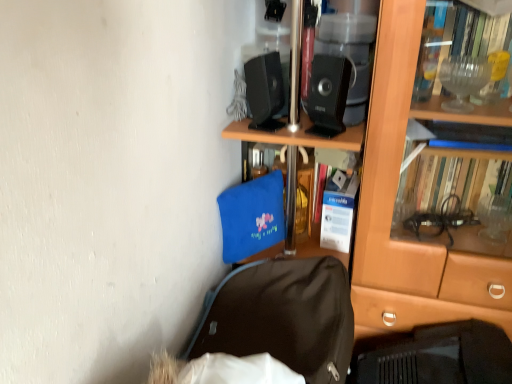
What do you see at coordinates (282, 316) in the screenshot? The image size is (512, 384). I see `black fabric backpack at lower center` at bounding box center [282, 316].

Where is `black fabric backpack at lower center`? This screenshot has height=384, width=512. black fabric backpack at lower center is located at coordinates (282, 316).

Where is `blue fabric bag at center`? This screenshot has height=384, width=512. blue fabric bag at center is located at coordinates (252, 216).

Measure the distance between point [254,201] and camera.

Point [254,201] and camera are 1.09 meters apart from each other.

What do you see at coordinates (441, 356) in the screenshot? This screenshot has height=384, width=512. I see `black matte laptop at lower right` at bounding box center [441, 356].

At what (x,y) coordinates should I click in order to perform the action: click on black plastic speaker at upper center, marked as the 2th loudspeaker in a left-to-right arrangement. Please return your answer as a coordinate pair (x, y). The width and height of the screenshot is (512, 384). Looking at the image, I should click on (328, 94).

Can you confirm if black matte laptop at lower right is smaller than black plastic speaker at upper center, which ranks as the 1th loudspeaker in left-to-right order?

Actually, black matte laptop at lower right might be larger than black plastic speaker at upper center, which ranks as the 1th loudspeaker in left-to-right order.

Based on the photo, from a real-world perspective, which is physically above, black matte laptop at lower right or black plastic speaker at upper center, which ranks as the 1th loudspeaker in left-to-right order?

black plastic speaker at upper center, which ranks as the 1th loudspeaker in left-to-right order, from a real-world perspective.

Is black matte laptop at lower right outside of black plastic speaker at upper center, which ranks as the 1th loudspeaker in left-to-right order?

black matte laptop at lower right is positioned outside black plastic speaker at upper center, which ranks as the 1th loudspeaker in left-to-right order.

Does black matte laptop at lower right lie behind black plastic speaker at upper center, which ranks as the 1th loudspeaker in left-to-right order?

No, it is in front of black plastic speaker at upper center, which ranks as the 1th loudspeaker in left-to-right order.

Is black matte laptop at lower right directly adjacent to brown wooden bookcase at center?

No.

Can you confirm if black matte laptop at lower right is bigger than brown wooden bookcase at center?

No, black matte laptop at lower right is not bigger than brown wooden bookcase at center.

I want to click on laptop below the brown wooden bookcase at center (from the image's perspective), so click(441, 356).

Is black matte laptop at lower right facing towards brown wooden bookcase at center?

No, black matte laptop at lower right is not oriented towards brown wooden bookcase at center.

Which is nearer, (270, 93) or (280, 198)?

Point (270, 93) is closer to the camera than point (280, 198).

From the image's perspective, relative to blue fabric bag at center, is black plastic speaker at upper center, positioned as the 2th loudspeaker in right-to-left order, above or below?

black plastic speaker at upper center, positioned as the 2th loudspeaker in right-to-left order, is above blue fabric bag at center.

From a real-world perspective, is black plastic speaker at upper center, positioned as the 2th loudspeaker in right-to-left order, physically located above or below blue fabric bag at center?

From a real-world perspective, black plastic speaker at upper center, positioned as the 2th loudspeaker in right-to-left order, is physically above blue fabric bag at center.

Find the location of a particular element. luggage and bags that is behind the black plastic speaker at upper center, positioned as the 2th loudspeaker in right-to-left order is located at coordinates (252, 216).

The width and height of the screenshot is (512, 384). In order to click on luggage and bags below the black plastic speaker at upper center, which is counted as the 1th loudspeaker, starting from the right (from the image's perspective) in this screenshot , I will do `click(252, 216)`.

From the image's perspective, which one is positioned higher, blue fabric bag at center or black plastic speaker at upper center, which is counted as the 1th loudspeaker, starting from the right?

black plastic speaker at upper center, which is counted as the 1th loudspeaker, starting from the right, from the image's perspective.

Who is bigger, blue fabric bag at center or black plastic speaker at upper center, which is counted as the 1th loudspeaker, starting from the right?

blue fabric bag at center.

Choose the correct answer: Is black matte laptop at lower right inside blue fabric bag at center or outside it?

black matte laptop at lower right lies outside blue fabric bag at center.

From the image's perspective, is black matte laptop at lower right positioned above or below blue fabric bag at center?

black matte laptop at lower right is below blue fabric bag at center.

In the scene shown: From a real-world perspective, who is located higher, black matte laptop at lower right or blue fabric bag at center?

blue fabric bag at center is physically above.

Considering the relative sizes of black matte laptop at lower right and blue fabric bag at center in the image provided, is black matte laptop at lower right wider than blue fabric bag at center?

Indeed, black matte laptop at lower right has a greater width compared to blue fabric bag at center.

Considering the sizes of black fabric backpack at lower center and black plastic speaker at upper center, marked as the 2th loudspeaker in a left-to-right arrangement, in the image, is black fabric backpack at lower center wider or thinner than black plastic speaker at upper center, marked as the 2th loudspeaker in a left-to-right arrangement,?

Clearly, black fabric backpack at lower center has more width compared to black plastic speaker at upper center, marked as the 2th loudspeaker in a left-to-right arrangement.

Relative to black plastic speaker at upper center, which is counted as the 1th loudspeaker, starting from the right, is black fabric backpack at lower center in front or behind?

black fabric backpack at lower center is in front of black plastic speaker at upper center, which is counted as the 1th loudspeaker, starting from the right.

From a real-world perspective, which object stands above the other?

From a 3D spatial view, black plastic speaker at upper center, marked as the 2th loudspeaker in a left-to-right arrangement, is above.

Based on the photo, can you see black fabric backpack at lower center touching black plastic speaker at upper center, which is counted as the 1th loudspeaker, starting from the right?

black fabric backpack at lower center and black plastic speaker at upper center, which is counted as the 1th loudspeaker, starting from the right, are not in contact.

Is brown wooden bookcase at center wider or thinner than black fabric backpack at lower center?

Clearly, brown wooden bookcase at center has more width compared to black fabric backpack at lower center.

Considering the sizes of objects brown wooden bookcase at center and black fabric backpack at lower center in the image provided, who is bigger, brown wooden bookcase at center or black fabric backpack at lower center?

With larger size is brown wooden bookcase at center.

Is point (245, 134) farther from viewer compared to point (231, 279)?

No, (245, 134) is in front of (231, 279).

Based on the photo, choose the correct answer: Is brown wooden bookcase at center inside black fabric backpack at lower center or outside it?

brown wooden bookcase at center is outside black fabric backpack at lower center.

From the image's perspective, count 2nd loudspeakers upward from the black matte laptop at lower right and point to it. Please provide its 2D coordinates.

[(264, 91)]

I want to click on laptop below the brown wooden bookcase at center (from the image's perspective), so click(x=441, y=356).

When comparing their distances from brown wooden bookcase at center, does black matte laptop at lower right or black fabric backpack at lower center seem further?

black fabric backpack at lower center.

Estimate the real-world distances between objects in this image. Which object is further from black matte laptop at lower right, black fabric backpack at lower center or black plastic speaker at upper center, marked as the 2th loudspeaker in a left-to-right arrangement?

Based on the image, black plastic speaker at upper center, marked as the 2th loudspeaker in a left-to-right arrangement, appears to be further to black matte laptop at lower right.

Looking at the image, which one is located further to black matte laptop at lower right, black plastic speaker at upper center, which ranks as the 1th loudspeaker in left-to-right order, or black plastic speaker at upper center, marked as the 2th loudspeaker in a left-to-right arrangement?

Based on the image, black plastic speaker at upper center, which ranks as the 1th loudspeaker in left-to-right order, appears to be further to black matte laptop at lower right.

In the scene shown: Considering their positions, is black fabric backpack at lower center positioned further to black plastic speaker at upper center, positioned as the 2th loudspeaker in right-to-left order, than black matte laptop at lower right?

Based on the image, black matte laptop at lower right appears to be further to black plastic speaker at upper center, positioned as the 2th loudspeaker in right-to-left order.

When comparing their distances from black fabric backpack at lower center, does black plastic speaker at upper center, marked as the 2th loudspeaker in a left-to-right arrangement, or brown wooden bookcase at center seem further?

black plastic speaker at upper center, marked as the 2th loudspeaker in a left-to-right arrangement.

Looking at the image, which one is located further to black matte laptop at lower right, blue fabric bag at center or black plastic speaker at upper center, positioned as the 2th loudspeaker in right-to-left order?

black plastic speaker at upper center, positioned as the 2th loudspeaker in right-to-left order, lies further to black matte laptop at lower right than the other object.

Considering their positions, is black plastic speaker at upper center, which ranks as the 1th loudspeaker in left-to-right order, positioned closer to black plastic speaker at upper center, marked as the 2th loudspeaker in a left-to-right arrangement, than black fabric backpack at lower center?

Among the two, black plastic speaker at upper center, which ranks as the 1th loudspeaker in left-to-right order, is located nearer to black plastic speaker at upper center, marked as the 2th loudspeaker in a left-to-right arrangement.

Estimate the real-world distances between objects in this image. Which object is further from blue fabric bag at center, black plastic speaker at upper center, marked as the 2th loudspeaker in a left-to-right arrangement, or black fabric backpack at lower center?

Based on the image, black plastic speaker at upper center, marked as the 2th loudspeaker in a left-to-right arrangement, appears to be further to blue fabric bag at center.

Image resolution: width=512 pixels, height=384 pixels. Find the location of `backpack located between blue fabric bag at center and brown wooden bookcase at center in the left-right direction`. backpack located between blue fabric bag at center and brown wooden bookcase at center in the left-right direction is located at coordinates (282, 316).

Image resolution: width=512 pixels, height=384 pixels. What are the coordinates of `luggage and bags between black plastic speaker at upper center, which is counted as the 1th loudspeaker, starting from the right, and black fabric backpack at lower center in the up-down direction` in the screenshot? It's located at (252, 216).

At what (x,y) coordinates should I click in order to perform the action: click on luggage and bags between black plastic speaker at upper center, marked as the 2th loudspeaker in a left-to-right arrangement, and black matte laptop at lower right, in the vertical direction. Please return your answer as a coordinate pair (x, y). Looking at the image, I should click on (252, 216).

Find the location of a particular element. The image size is (512, 384). backpack that lies between black plastic speaker at upper center, which is counted as the 1th loudspeaker, starting from the right, and black matte laptop at lower right from top to bottom is located at coordinates tap(282, 316).